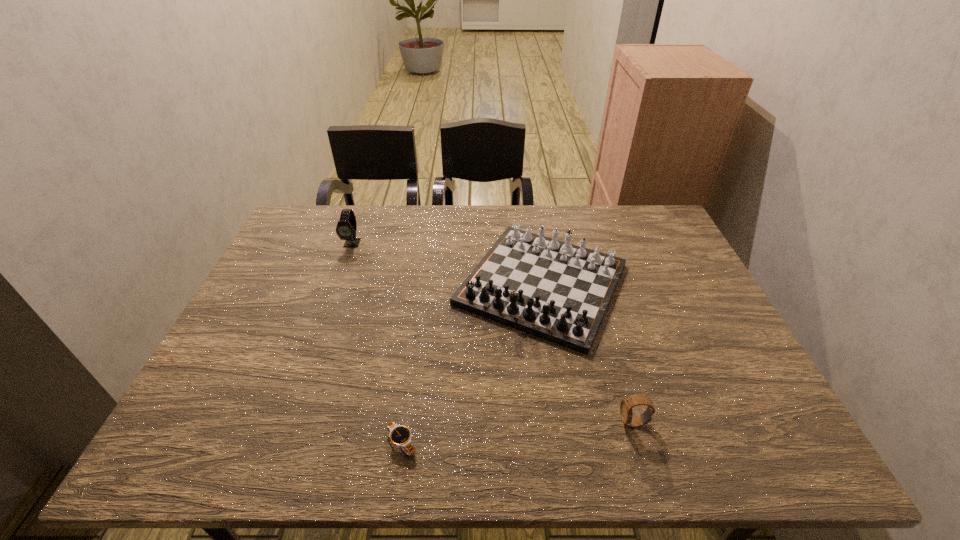
Find the location of a particular element. The width and height of the screenshot is (960, 540). free region located on the face of the second tallest watch is located at coordinates (477, 423).

Image resolution: width=960 pixels, height=540 pixels. What are the coordinates of `vacant space located 0.050m on the left of the second watch from left to right` in the screenshot? It's located at [x=361, y=443].

You are a GUI agent. You are given a task and a screenshot of the screen. Output one action in this format:
    pyautogui.click(x=<x>, y=<y>)
    Task: Click on the watch located in the far edge section of the desktop
    The width and height of the screenshot is (960, 540).
    Given the screenshot: What is the action you would take?
    (x=346, y=228)

Identify the location of chessboard located at the far edge. (557, 291).

Find the location of a particular element. Image resolution: width=960 pixels, height=540 pixels. free spot at the far edge of the desktop is located at coordinates (446, 213).

The height and width of the screenshot is (540, 960). In the image, there is a desktop. Identify the location of vacant space at the near edge. (709, 453).

Find the location of a particular element. The width and height of the screenshot is (960, 540). vacant point at the left edge is located at coordinates [x=218, y=374].

In the image, there is a desktop. Identify the location of vacant space at the right edge. (679, 249).

At what (x,y) coordinates should I click in order to perform the action: click on blank space at the far left corner of the desktop. Please return your answer as a coordinate pair (x, y). Image resolution: width=960 pixels, height=540 pixels. Looking at the image, I should click on pos(308,242).

At what (x,y) coordinates should I click in order to perform the action: click on vacant region at the far right corner of the desktop. Please return your answer as a coordinate pair (x, y). Image resolution: width=960 pixels, height=540 pixels. Looking at the image, I should click on (628, 220).